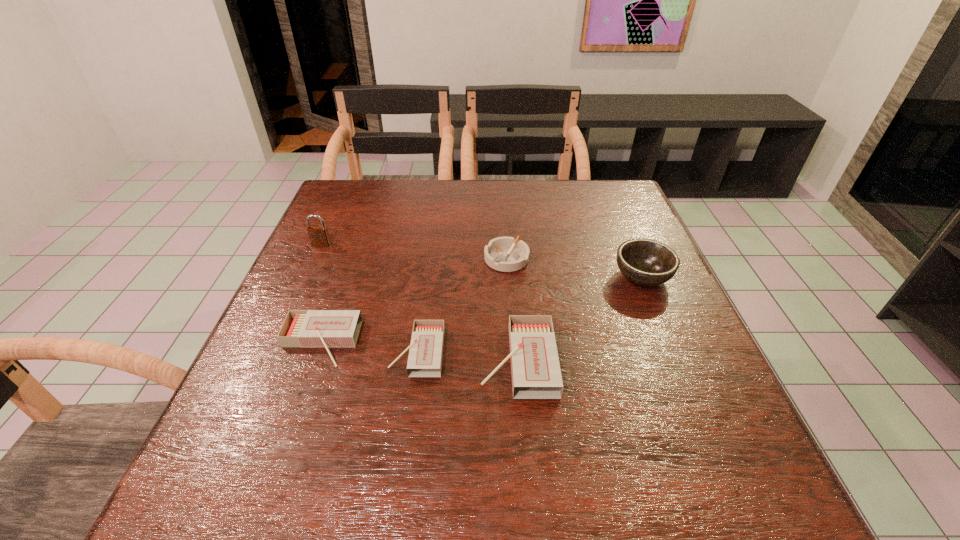
Locate an element on the screen. vacant space located on the striking surface of the third object from left to right is located at coordinates (351, 352).

At what (x,y) coordinates should I click in order to perform the action: click on vacant area located on the striking surface of the third object from left to right. Please return your answer as a coordinate pair (x, y). The height and width of the screenshot is (540, 960). Looking at the image, I should click on (271, 352).

Locate an element on the screen. The width and height of the screenshot is (960, 540). vacant area located on the striking surface of the third object from left to right is located at coordinates (266, 352).

The height and width of the screenshot is (540, 960). I want to click on vacant space located 0.220m on the striking surface of the rightmost matchbox, so click(369, 360).

At what (x,y) coordinates should I click in order to perform the action: click on vacant position located 0.210m on the striking surface of the rightmost matchbox. Please return your answer as a coordinate pair (x, y). This screenshot has height=540, width=960. Looking at the image, I should click on (373, 360).

Where is `vacant space located on the striking surface of the rightmost matchbox`? The width and height of the screenshot is (960, 540). vacant space located on the striking surface of the rightmost matchbox is located at coordinates (298, 360).

Locate an element on the screen. The width and height of the screenshot is (960, 540). free space located 0.320m on the back of the second tallest object is located at coordinates (607, 193).

I want to click on free space located on the front-facing side of the padlock, so click(315, 259).

Find the location of a particular element. Image resolution: width=960 pixels, height=540 pixels. vacant area situated on the right of the ashtray is located at coordinates (640, 259).

Locate an element on the screen. object that is at the near edge is located at coordinates (x=535, y=368).